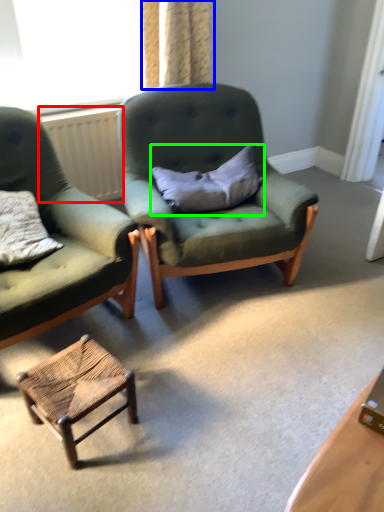
Question: Estimate the real-world distances between objects in this image. Which object is closer to radiator (highlighted by a red box), curtain (highlighted by a blue box) or pillow (highlighted by a green box)?

Choices:
 (A) curtain
 (B) pillow

Answer: (A)